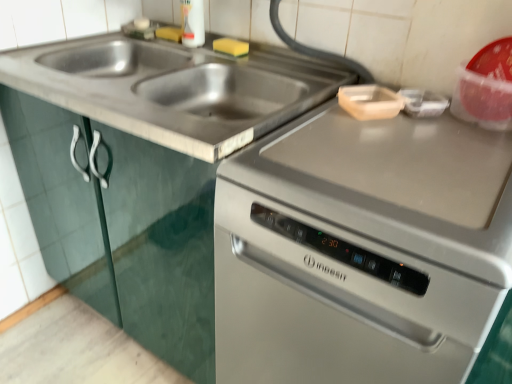
Question: Is stainless steel dishwasher at center taller than satin silver oven at right?

Choices:
 (A) yes
 (B) no

Answer: (B)

Question: From a real-world perspective, is stainless steel dishwasher at center on top of satin silver oven at right?

Choices:
 (A) yes
 (B) no

Answer: (B)

Question: Is stainless steel dishwasher at center to the right of satin silver oven at right from the viewer's perspective?

Choices:
 (A) no
 (B) yes

Answer: (A)

Question: Is stainless steel dishwasher at center not within satin silver oven at right?

Choices:
 (A) no
 (B) yes

Answer: (B)

Question: Does stainless steel dishwasher at center come in front of satin silver oven at right?

Choices:
 (A) no
 (B) yes

Answer: (A)

Question: Looking at the image, does wooden cutting board at upper right seem bigger or smaller compared to stainless steel sink at upper left?

Choices:
 (A) small
 (B) big

Answer: (A)

Question: Considering the positions of wooden cutting board at upper right and stainless steel sink at upper left in the image, is wooden cutting board at upper right taller or shorter than stainless steel sink at upper left?

Choices:
 (A) tall
 (B) short

Answer: (B)

Question: Based on their positions, is wooden cutting board at upper right located to the left or right of stainless steel sink at upper left?

Choices:
 (A) left
 (B) right

Answer: (B)

Question: Which is correct: wooden cutting board at upper right is inside stainless steel sink at upper left, or outside of it?

Choices:
 (A) outside
 (B) inside

Answer: (A)

Question: From the image's perspective, is stainless steel dishwasher at center above or below satin silver oven at right?

Choices:
 (A) below
 (B) above

Answer: (B)

Question: From their relative heights in the image, would you say stainless steel dishwasher at center is taller or shorter than satin silver oven at right?

Choices:
 (A) tall
 (B) short

Answer: (B)

Question: Is point (46, 251) positioned closer to the camera than point (434, 205)?

Choices:
 (A) farther
 (B) closer

Answer: (A)

Question: Considering the positions of stainless steel dishwasher at center and satin silver oven at right in the image, is stainless steel dishwasher at center wider or thinner than satin silver oven at right?

Choices:
 (A) wide
 (B) thin

Answer: (B)

Question: Is wooden cutting board at upper right taller or shorter than satin silver oven at right?

Choices:
 (A) tall
 (B) short

Answer: (B)

Question: From a real-world perspective, is wooden cutting board at upper right physically located above or below satin silver oven at right?

Choices:
 (A) below
 (B) above

Answer: (B)